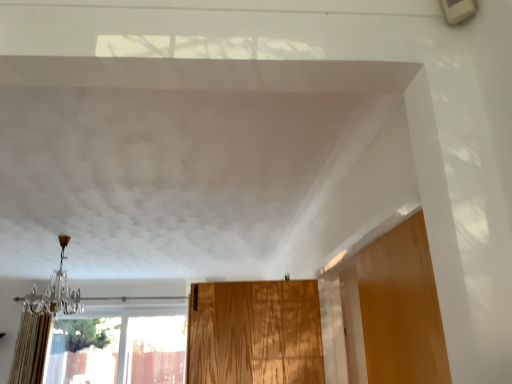
Locate an element on the screen. The image size is (512, 384). transparent glass window at lower left is located at coordinates (120, 345).

How distant is transparent glass window at lower left from crystal glass chandelier at left?

They are 1.35 meters apart.

Is crystal glass chandelier at left surrounded by transparent glass window at lower left?

No, crystal glass chandelier at left is located outside of transparent glass window at lower left.

How many degrees apart are the facing directions of transparent glass window at lower left and crystal glass chandelier at left?

4.91 degrees.

Can you confirm if transparent glass window at lower left is shorter than crystal glass chandelier at left?

Incorrect, the height of transparent glass window at lower left does not fall short of that of crystal glass chandelier at left.

Would you say transparent glass window at lower left is part of beige textured curtain at left's contents?

No, transparent glass window at lower left is not a part of beige textured curtain at left.

This screenshot has height=384, width=512. I want to click on curtain that is above the transparent glass window at lower left (from the image's perspective), so click(31, 349).

Considering the sizes of beige textured curtain at left and transparent glass window at lower left in the image, is beige textured curtain at left wider or thinner than transparent glass window at lower left?

Considering their sizes, beige textured curtain at left looks broader than transparent glass window at lower left.

Considering the positions of points (17, 340) and (174, 310), is point (17, 340) farther from camera compared to point (174, 310)?

No, it is not.

From a real-world perspective, between crystal glass chandelier at left and beige textured curtain at left, who is vertically higher?

From a 3D spatial view, crystal glass chandelier at left is above.

Is crystal glass chandelier at left facing away from beige textured curtain at left?

No.

Considering the relative sizes of crystal glass chandelier at left and beige textured curtain at left in the image provided, is crystal glass chandelier at left shorter than beige textured curtain at left?

Yes.

Is point (68, 311) closer or farther from the camera than point (26, 350)?

Point (68, 311) is positioned closer to the camera compared to point (26, 350).

Between transparent glass window at lower left and beige textured curtain at left, which one has more height?

beige textured curtain at left.

Is transparent glass window at lower left oriented away from beige textured curtain at left?

No.

Locate an element on the screen. Image resolution: width=512 pixels, height=384 pixels. curtain that appears above the transparent glass window at lower left (from a real-world perspective) is located at coordinates (31, 349).

Considering the relative sizes of beige textured curtain at left and crystal glass chandelier at left in the image provided, is beige textured curtain at left thinner than crystal glass chandelier at left?

Indeed, beige textured curtain at left has a lesser width compared to crystal glass chandelier at left.

Could you tell me if beige textured curtain at left is facing crystal glass chandelier at left?

No, beige textured curtain at left is not turned towards crystal glass chandelier at left.

From the image's perspective, is beige textured curtain at left located beneath crystal glass chandelier at left?

Yes, from the image's perspective, beige textured curtain at left is beneath crystal glass chandelier at left.

Which is correct: beige textured curtain at left is inside crystal glass chandelier at left, or outside of it?

beige textured curtain at left is not inside crystal glass chandelier at left, it's outside.

Can transparent glass window at lower left be found inside crystal glass chandelier at left?

Definitely not — transparent glass window at lower left is not inside crystal glass chandelier at left.

Is crystal glass chandelier at left thinner than transparent glass window at lower left?

Incorrect, the width of crystal glass chandelier at left is not less than that of transparent glass window at lower left.

Image resolution: width=512 pixels, height=384 pixels. Identify the location of window behind the crystal glass chandelier at left. (120, 345).

How much distance is there between crystal glass chandelier at left and transparent glass window at lower left?

4.44 feet.

Where is `window below the crystal glass chandelier at left (from the image's perspective)`? window below the crystal glass chandelier at left (from the image's perspective) is located at coordinates (120, 345).

The height and width of the screenshot is (384, 512). I want to click on curtain that appears above the transparent glass window at lower left (from a real-world perspective), so click(31, 349).

When comparing their distances from beige textured curtain at left, does transparent glass window at lower left or crystal glass chandelier at left seem closer?

Among the two, crystal glass chandelier at left is located nearer to beige textured curtain at left.

When comparing their distances from beige textured curtain at left, does crystal glass chandelier at left or transparent glass window at lower left seem closer?

Based on the image, crystal glass chandelier at left appears to be nearer to beige textured curtain at left.

Estimate the real-world distances between objects in this image. Which object is further from crystal glass chandelier at left, transparent glass window at lower left or beige textured curtain at left?

transparent glass window at lower left is positioned further to the anchor crystal glass chandelier at left.

Which object lies further to the anchor point transparent glass window at lower left, beige textured curtain at left or crystal glass chandelier at left?

crystal glass chandelier at left.

Looking at the image, which one is located further to crystal glass chandelier at left, beige textured curtain at left or transparent glass window at lower left?

transparent glass window at lower left is positioned further to the anchor crystal glass chandelier at left.

From the image, which object appears to be farther from transparent glass window at lower left, crystal glass chandelier at left or beige textured curtain at left?

crystal glass chandelier at left lies further to transparent glass window at lower left than the other object.

Identify the location of curtain between crystal glass chandelier at left and transparent glass window at lower left in the front-back direction. tap(31, 349).